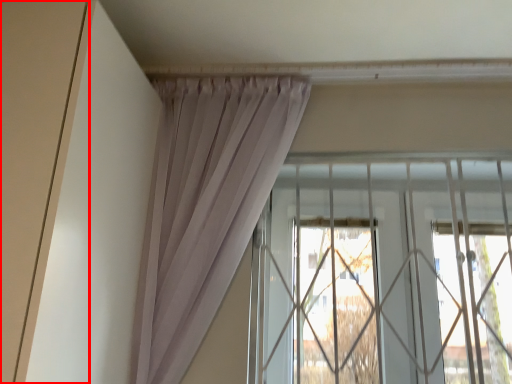
Question: In this image, where is door (annotated by the red box) located relative to window?

Choices:
 (A) right
 (B) left

Answer: (B)